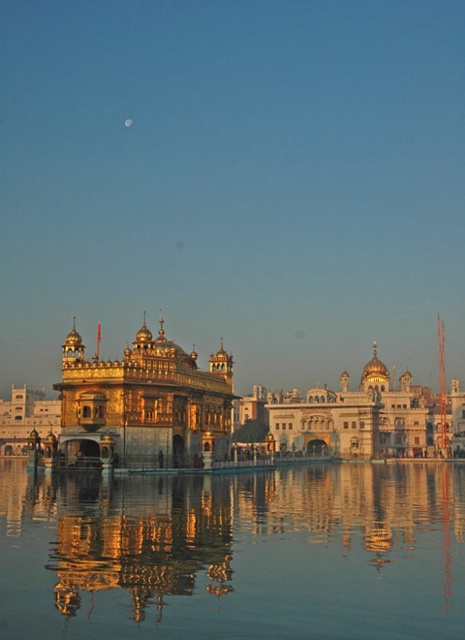
You are a photographer planning to capture the Golden Temple and the moon in the same frame. Given that your camera has a focal length of 200mm, which is suitable for capturing distant objects, can you determine if the golden polished temple at center and the silvery reflective moon at upper center can be framed together in a single shot?

The golden polished temple at center and the silvery reflective moon at upper center are 131.71 meters apart. Since the camera has a 200mm focal length, which is capable of capturing distant objects within a reasonable field of view, it should be possible to frame both objects in a single shot without needing to adjust the camera position significantly.

You are a tourist visiting the Golden Temple and want to take a photo of the golden polished temple at center and its reflection in the transparent glass water at center. Based on the scene description, where should you position yourself to capture both the temple and its reflection in the same frame?

You should position yourself at a lower angle so that you can see both the golden polished temple at center and its reflection in the transparent glass water at center, as the transparent glass water at center is located below the temple.